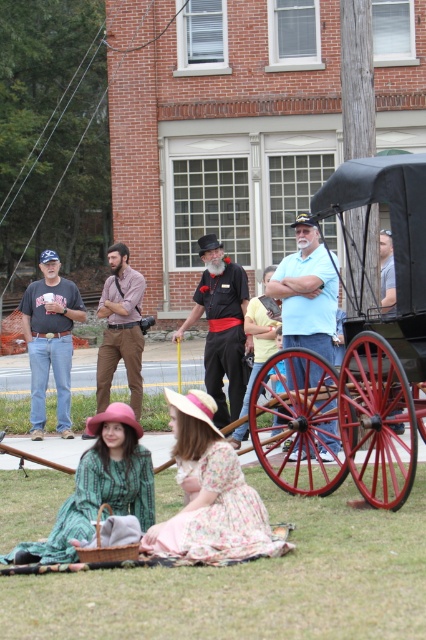
You are standing at the center of the image and want to step onto the green grass at lower center. Based on your current position, in which direction should you move to reach it?

The green grass at lower center is located at point (252, 582), so you should move downward and to the right to reach it.

You are a photographer taking a picture of the green grass at lower center and the green plaid dress at lower left. Which object should you focus on first if you want to capture both in sharp focus?

The green plaid dress at lower left should be focused on first because it is larger than the green grass at lower center, making it more prominent in the frame.